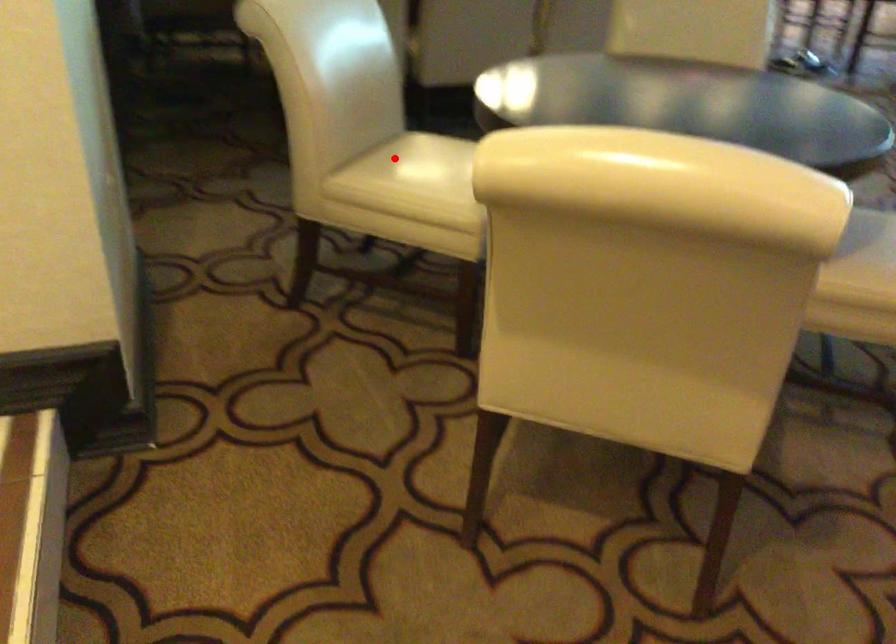
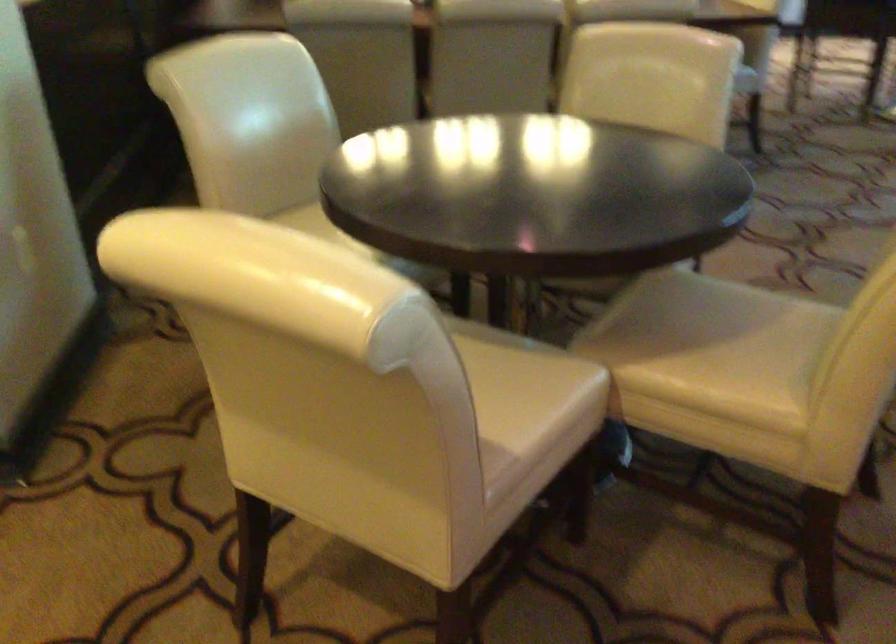
The point at the highlighted location is marked in the first image. Where is the corresponding point in the second image?

(306, 220)